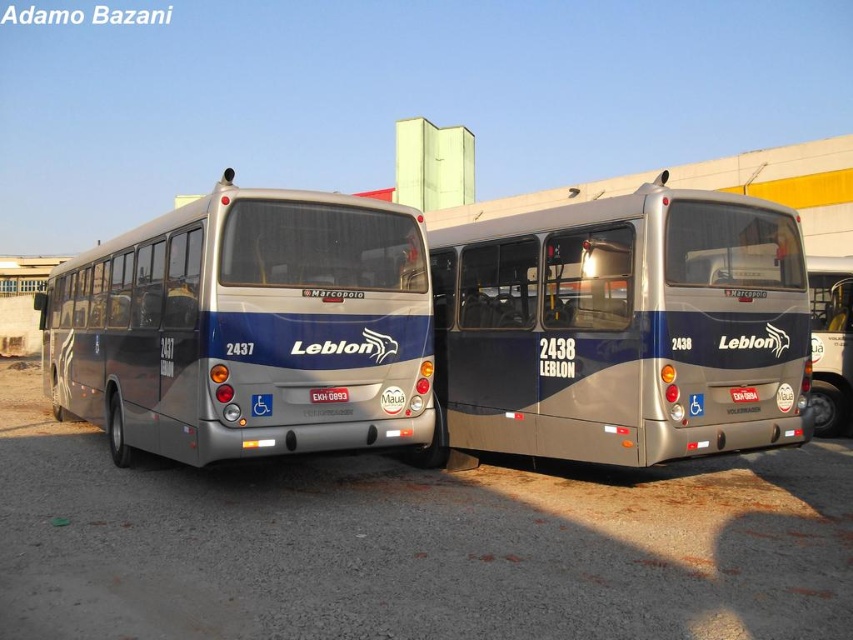
You are standing at a bus depot where two Leblon buses are parked side by side. The left bus has the number 2437 and the right bus has the number 2438. You notice a point marked at coordinates point [122,323]. If you want to take a photo of this point from exactly 25 feet away, will you be able to do so?

The point [122,323] is 27.32 feet away from the camera, so you cannot take the photo from exactly 25 feet away since it is farther than the required distance.